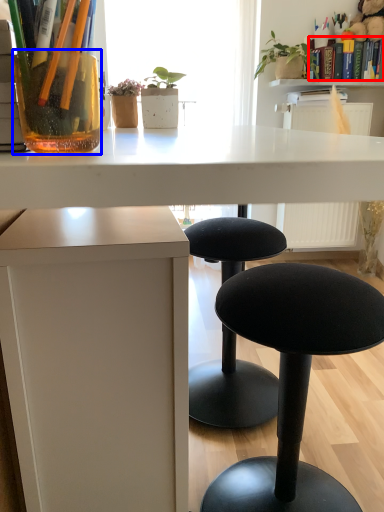
Question: Among these objects, which one is nearest to the camera, book (highlighted by a red box) or vase (highlighted by a blue box)?

Choices:
 (A) book
 (B) vase

Answer: (B)